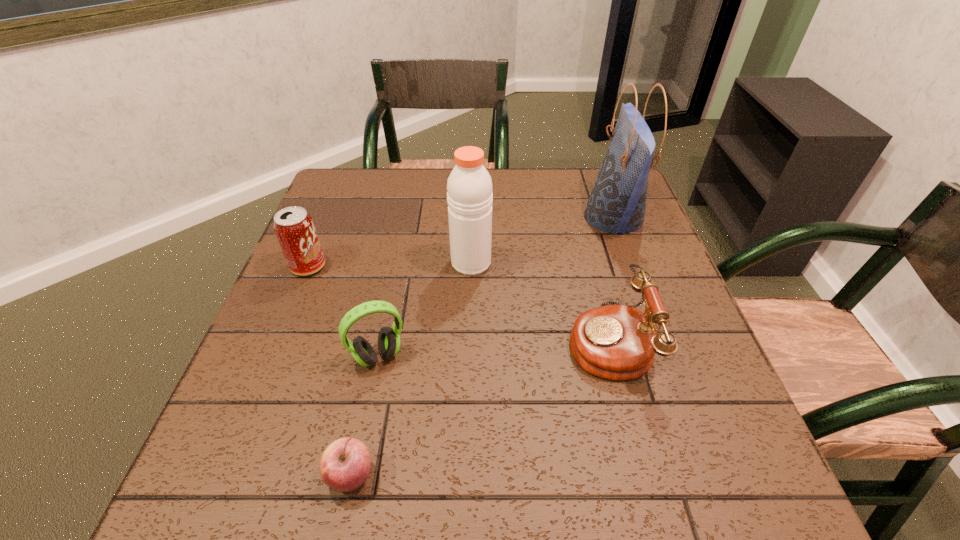
Locate an element on the screen. The height and width of the screenshot is (540, 960). shopping bag situated at the right edge is located at coordinates pos(617,203).

In order to click on telephone located at the right edge in this screenshot , I will do `click(617, 342)`.

The image size is (960, 540). I want to click on object at the far right corner, so click(617, 203).

Find the location of a particular element. The width and height of the screenshot is (960, 540). vacant region at the far edge of the desktop is located at coordinates (426, 195).

The image size is (960, 540). What are the coordinates of `vacant region at the near edge of the desktop` in the screenshot? It's located at (568, 469).

You are a GUI agent. You are given a task and a screenshot of the screen. Output one action in this format:
    pyautogui.click(x=<x>, y=<y>)
    Task: Click on the free space at the left edge
    The image size is (960, 540).
    Given the screenshot: What is the action you would take?
    tap(270, 451)

This screenshot has height=540, width=960. What are the coordinates of `vacant space at the right edge` in the screenshot? It's located at (633, 240).

You are a GUI agent. You are given a task and a screenshot of the screen. Output one action in this format:
    pyautogui.click(x=<x>, y=<y>)
    Task: Click on the vacant region at the far left corner of the desktop
    This screenshot has width=960, height=540.
    Given the screenshot: What is the action you would take?
    pyautogui.click(x=382, y=183)

Identify the location of free space between the soda can and the nearest object. This screenshot has height=540, width=960. (329, 371).

I want to click on unoccupied position between the soda can and the telephone, so click(458, 303).